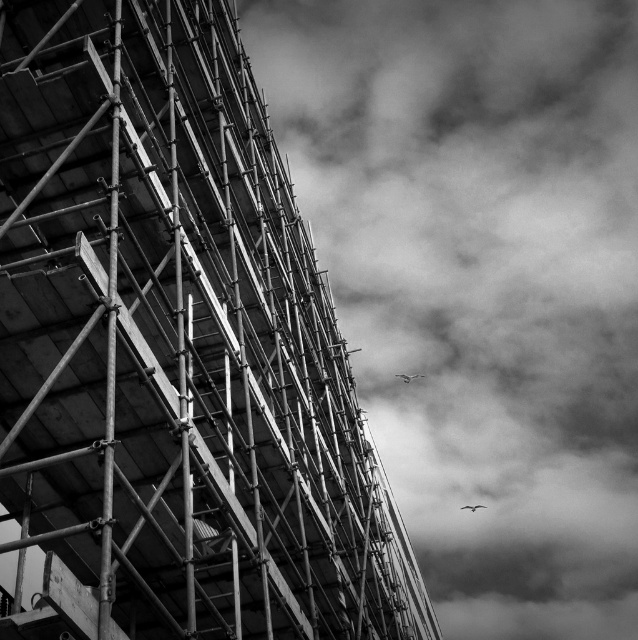
Question: Can you confirm if cloudy sky at upper right is positioned to the right of gray feathered bird at center?

Choices:
 (A) yes
 (B) no

Answer: (A)

Question: Which of the following is the closest to the observer?

Choices:
 (A) (505, 118)
 (B) (473, 506)
 (C) (412, 374)

Answer: (B)

Question: Can you confirm if gray feathered bird at center is positioned below white feathered bird at upper right?

Choices:
 (A) no
 (B) yes

Answer: (A)

Question: Which object is closer to the camera taking this photo?

Choices:
 (A) metal scaffolding at left
 (B) white feathered bird at upper right
 (C) gray feathered bird at center

Answer: (A)

Question: Does metal scaffolding at left lie behind cloudy sky at upper right?

Choices:
 (A) yes
 (B) no

Answer: (B)

Question: Which point is farther to the camera?

Choices:
 (A) (464, 508)
 (B) (410, 376)

Answer: (A)